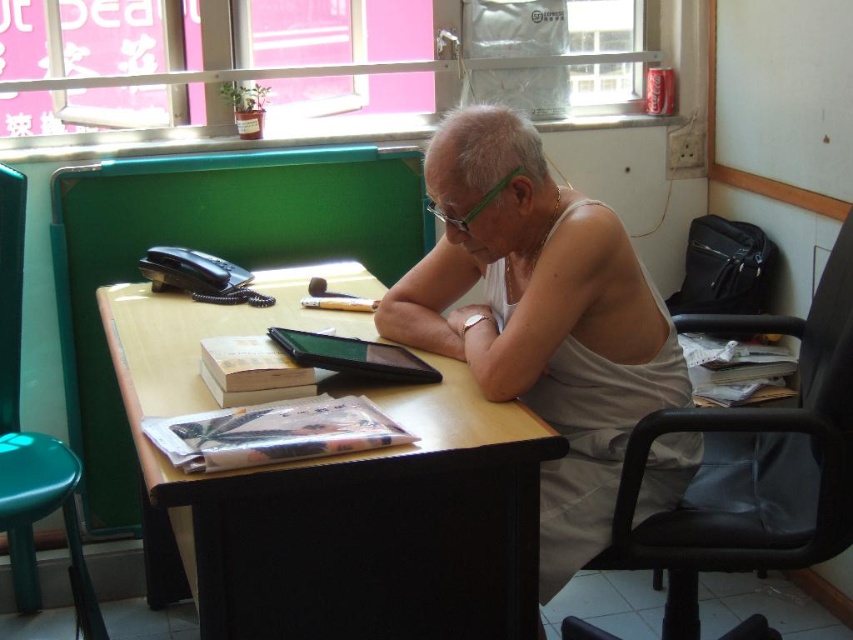
You are standing in the scene and want to move from the point at coordinates point (18, 512) to the point at coordinates point (325, 340). According to the spatial relationship between these two points, which direction should you move?

Since point (18, 512) is behind point (325, 340), you should move forward to reach point (325, 340) from point (18, 512).

You are standing in a small office and see the point at coordinates (541, 320). What object is located at that point?

The point at coordinates (541, 320) corresponds to the white cotton tank top at center.

You are planning to place a rectangular box that is 1.2 meters wide on the wooden table at center. Considering the black leather chair at right is positioned next to it, will the box fit on the table without overlapping the chair?

The wooden table at center might be wider than black leather chair at right, so there is a possibility that the box could fit without overlapping, but the exact dimensions are uncertain. Check the table width first.